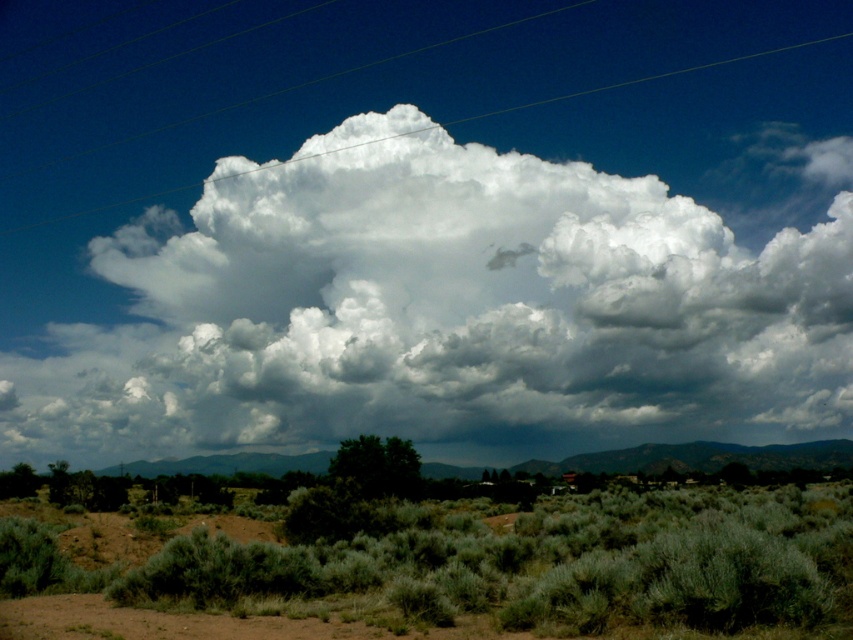
Is point (440, 168) positioned behind point (572, 570)?

Yes, point (440, 168) is farther from viewer.

Does white fluffy cloud at upper center have a larger size compared to green shrubbery at lower center?

Yes.

Between point (347, 339) and point (473, 563), which one is positioned in front?

Point (473, 563) is in front.

Locate an element on the screen. white fluffy cloud at upper center is located at coordinates (462, 307).

Who is shorter, green shrubbery at lower center or clear plastic power lines at upper center?

Standing shorter between the two is green shrubbery at lower center.

Who is positioned more to the left, green shrubbery at lower center or clear plastic power lines at upper center?

From the viewer's perspective, clear plastic power lines at upper center appears more on the left side.

Is point (817, 554) positioned before point (250, 97)?

Yes, point (817, 554) is closer to viewer.

Image resolution: width=853 pixels, height=640 pixels. In order to click on green shrubbery at lower center in this screenshot , I will do pos(509,570).

Which of these two, white fluffy cloud at upper center or clear plastic power lines at upper center, stands shorter?

Standing shorter between the two is clear plastic power lines at upper center.

Is the position of white fluffy cloud at upper center more distant than that of clear plastic power lines at upper center?

No, white fluffy cloud at upper center is in front of clear plastic power lines at upper center.

Locate an element on the screen. The height and width of the screenshot is (640, 853). white fluffy cloud at upper center is located at coordinates (462, 307).